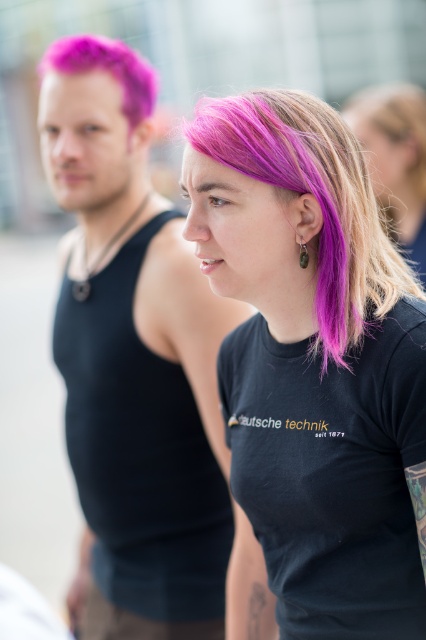
You are a photographer trying to adjust your camera focus. You have two points in the image to focus on, point 1 at coordinate point (420,125) and point 2 at coordinate point (301,250). Which point is closer to you and should be focused on first?

Point (420,125) is closer to you than point (301,250), so you should focus on point (420,125) first.

You are standing at the point marked as point (393, 604) in the image. You want to take a photo of the two people in the scene. Will you be able to capture both individuals in your camera frame without moving your position?

The point (393, 604) is 4.70 feet away from the viewer. Since both individuals are within the same scene and the distance is manageable, you can capture both in the camera frame without moving.